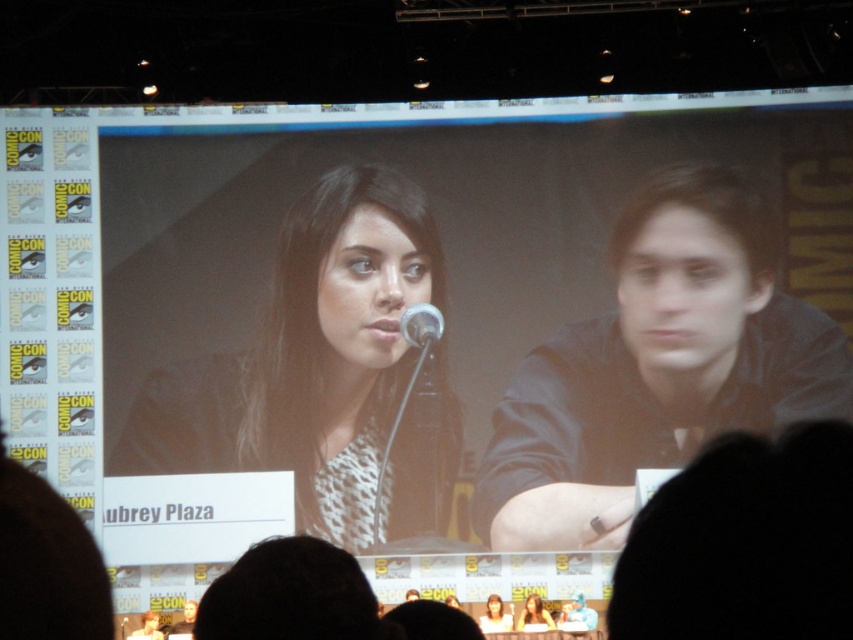
You are standing in the audience at the Comic Con panel and want to know which of the two points, point (x=660, y=336) or point (x=419, y=310), is closer to you. Can you determine this based on their positions?

Point (x=660, y=336) is further to the viewer than point (x=419, y=310), so point (x=419, y=310) is closer to you.

You are an attendee at Comic Con and want to take a photo of the dark gray shirt at right and the matte black dress at center. Which one is located to the right of the other?

The dark gray shirt at right is positioned on the right side of the matte black dress at center.

You are attending Comic Con and are standing in the front row of the panel discussion. You notice two points marked on the screen where the speakers are seated. The first point is at coordinates point (x=697, y=397) and the second is at point (x=505, y=621). Which point is closer to you?

Point (x=697, y=397) is closer to you because it is further to the viewer than point (x=505, y=621).